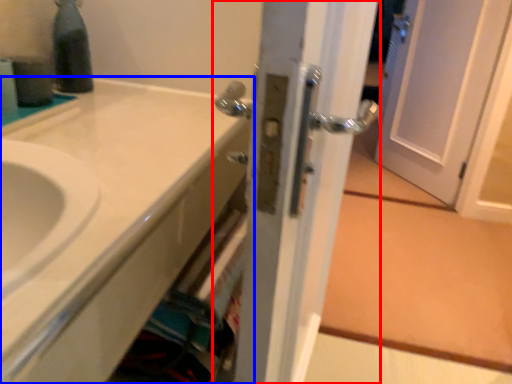
Question: Which point is closer to the camera, door (highlighted by a red box) or bathroom cabinet (highlighted by a blue box)?

Choices:
 (A) door
 (B) bathroom cabinet

Answer: (A)